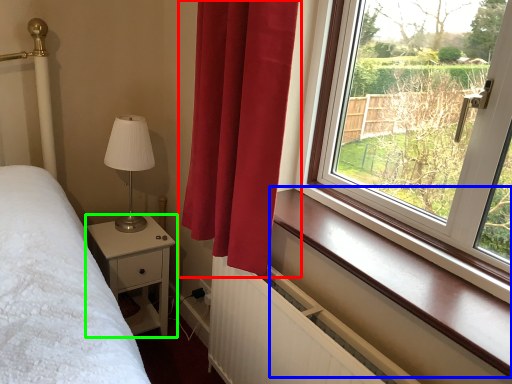
Question: Which object is positioned closest to curtain (highlighted by a red box)? Select from window sill (highlighted by a blue box) and nightstand (highlighted by a green box).

Choices:
 (A) window sill
 (B) nightstand

Answer: (A)